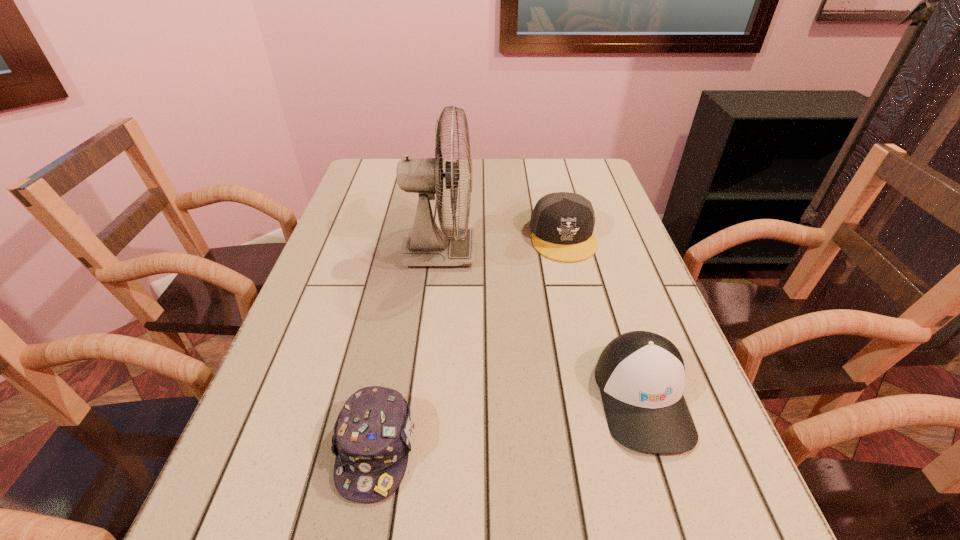
You are a GUI agent. You are given a task and a screenshot of the screen. Output one action in this format:
    pyautogui.click(x=<x>, y=<y>)
    Task: Click on the headwear that is the second closest to the farthest headwear
    This screenshot has width=960, height=540.
    Given the screenshot: What is the action you would take?
    372,438

Locate which headwear ranks in proximity to the tallest object. Please provide its 2D coordinates. Your answer should be formatted as a tuple, i.e. [(x, y)], where the tuple contains the x and y coordinates of a point satisfying the conditions above.

[(562, 223)]

Locate an element on the screen. vacant space that satisfies the following two spatial constraints: 1. on the front-facing side of the tallest object; 2. on the front-facing side of the shortest object is located at coordinates (420, 449).

Find the location of a particular element. This screenshot has height=540, width=960. free space that satisfies the following two spatial constraints: 1. on the front-facing side of the tallest object; 2. on the front-facing side of the shortest headwear is located at coordinates (420, 449).

Locate an element on the screen. Image resolution: width=960 pixels, height=540 pixels. vacant space that satisfies the following two spatial constraints: 1. on the front-facing side of the fan; 2. on the front-facing side of the shortest object is located at coordinates pos(420,449).

Where is `free space that satisfies the following two spatial constraints: 1. on the front-facing side of the farthest headwear; 2. on the front-facing side of the tallest object`? free space that satisfies the following two spatial constraints: 1. on the front-facing side of the farthest headwear; 2. on the front-facing side of the tallest object is located at coordinates (566, 252).